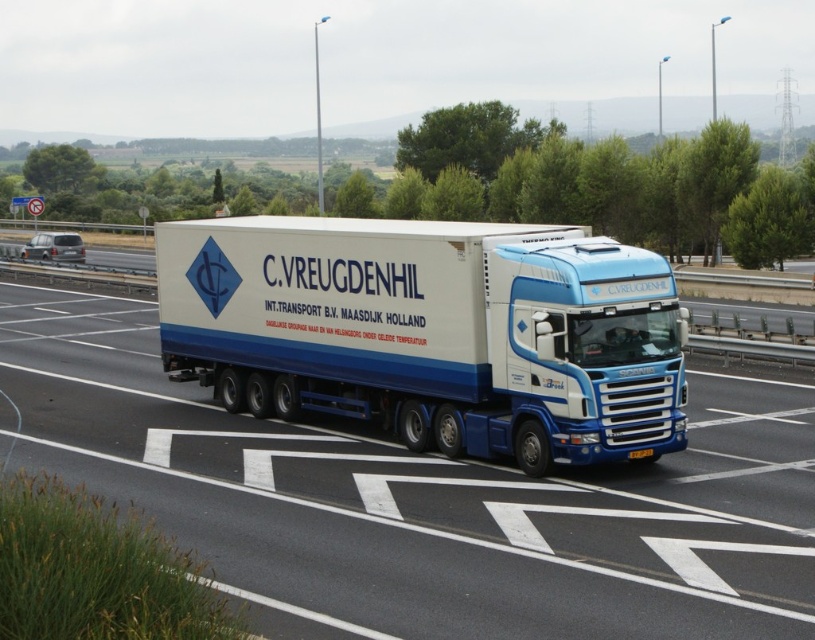
Can you confirm if blue metallic truck at center is wider than yellow matte license plate at center?

Yes.

Who is positioned more to the left, blue metallic truck at center or yellow matte license plate at center?

blue metallic truck at center is more to the left.

Consider the image. Measure the distance between point (280,301) and camera.

14.58 meters

Find the location of `blue metallic truck at center`. blue metallic truck at center is located at coordinates (430, 332).

Can you confirm if white matte truck at center is positioned to the left of blue metallic truck at center?

Correct, you'll find white matte truck at center to the left of blue metallic truck at center.

Image resolution: width=815 pixels, height=640 pixels. I want to click on white matte truck at center, so click(x=421, y=500).

This screenshot has height=640, width=815. Describe the element at coordinates (421, 500) in the screenshot. I see `white matte truck at center` at that location.

What are the coordinates of `white matte truck at center` in the screenshot? It's located at (421, 500).

Which of these two, white matte truck at center or yellow matte license plate at center, stands shorter?

yellow matte license plate at center

This screenshot has width=815, height=640. Describe the element at coordinates (421, 500) in the screenshot. I see `white matte truck at center` at that location.

Identify the location of white matte truck at center. (421, 500).